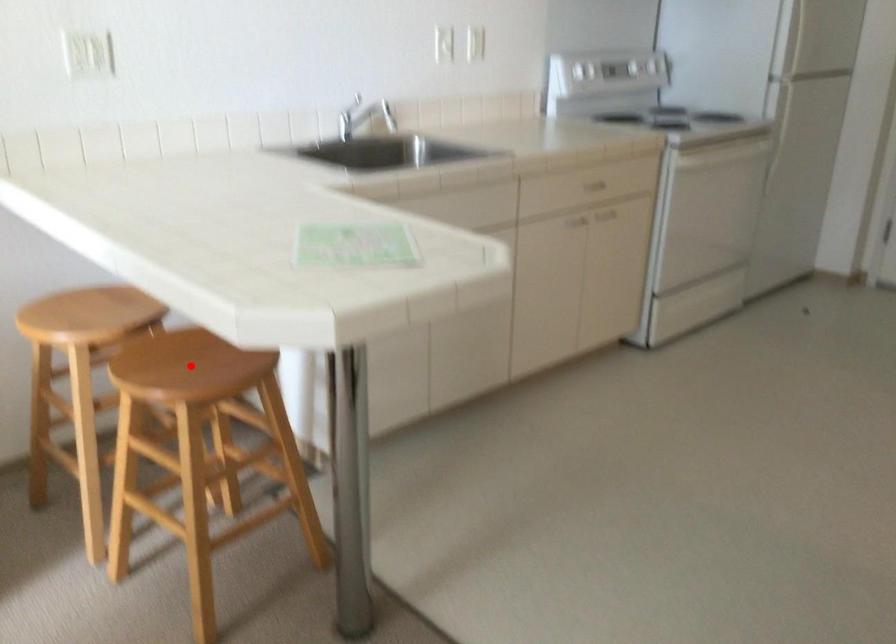
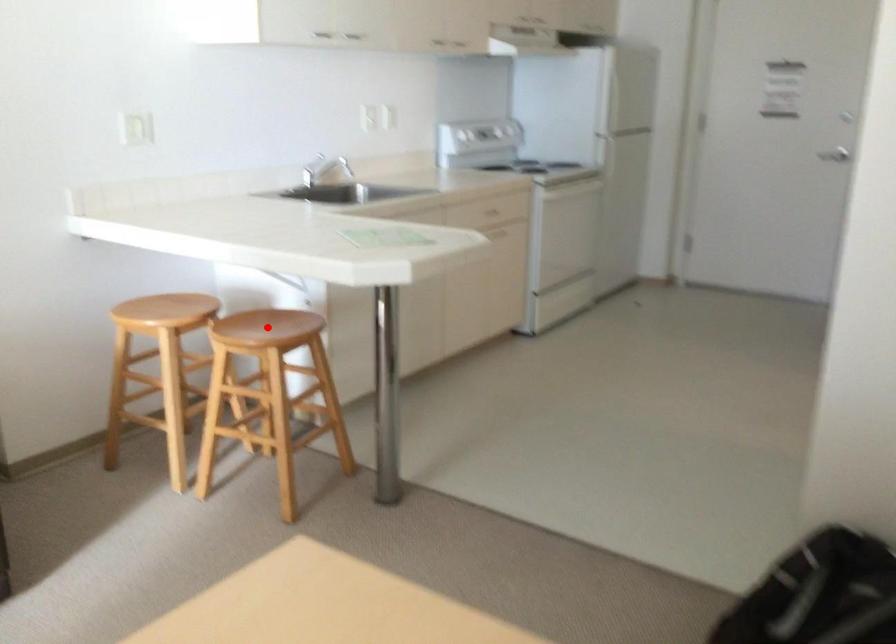
I am providing you with two images of the same scene from different viewpoints. A red point is marked on the first image and another point is marked on the second image. Is the marked point in image1 the same physical position as the marked point in image2?

Yes